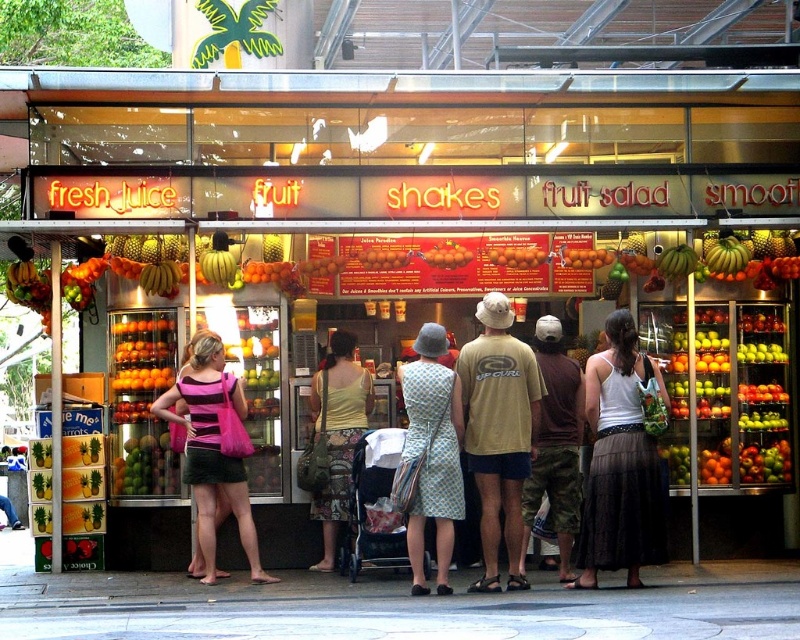
Question: Can you confirm if smooth orange smoothie at center is bigger than orange matte/orange smoothie at center?

Choices:
 (A) yes
 (B) no

Answer: (A)

Question: Among these points, which one is nearest to the camera?

Choices:
 (A) (208, 547)
 (B) (510, 465)
 (C) (322, 525)

Answer: (B)

Question: Is shiny plastic fruits at center wider than smooth orange fruit at center?

Choices:
 (A) no
 (B) yes

Answer: (A)

Question: Which point is closer to the camera taking this photo?

Choices:
 (A) (470, 385)
 (B) (342, 449)

Answer: (A)

Question: Which of these objects is positioned closest to the white cotton tank top at center?

Choices:
 (A) camouflage pants at center
 (B) smooth orange fruit at center
 (C) smooth orange smoothie at center

Answer: (A)

Question: Does camouflage pants at center appear over orange matte/orange at center?

Choices:
 (A) yes
 (B) no

Answer: (B)